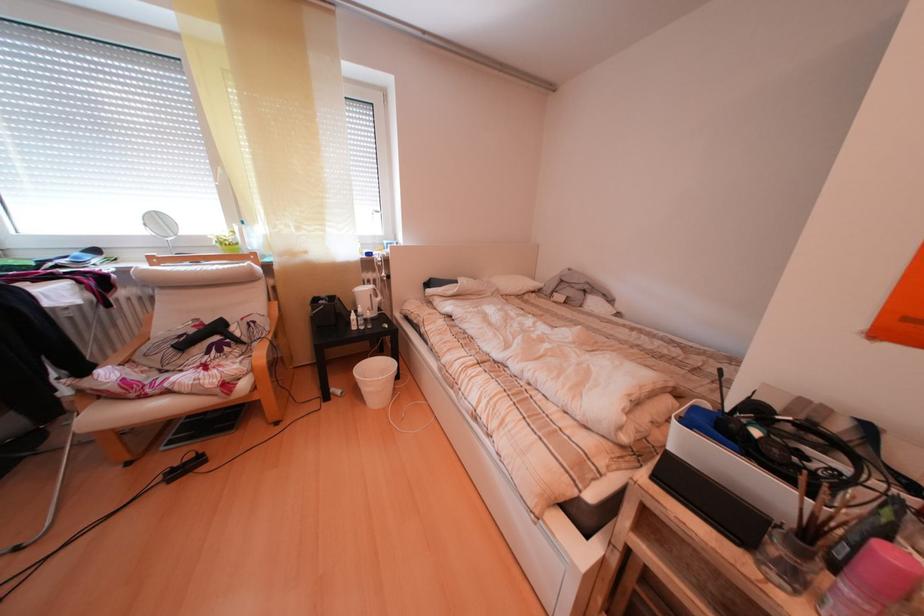
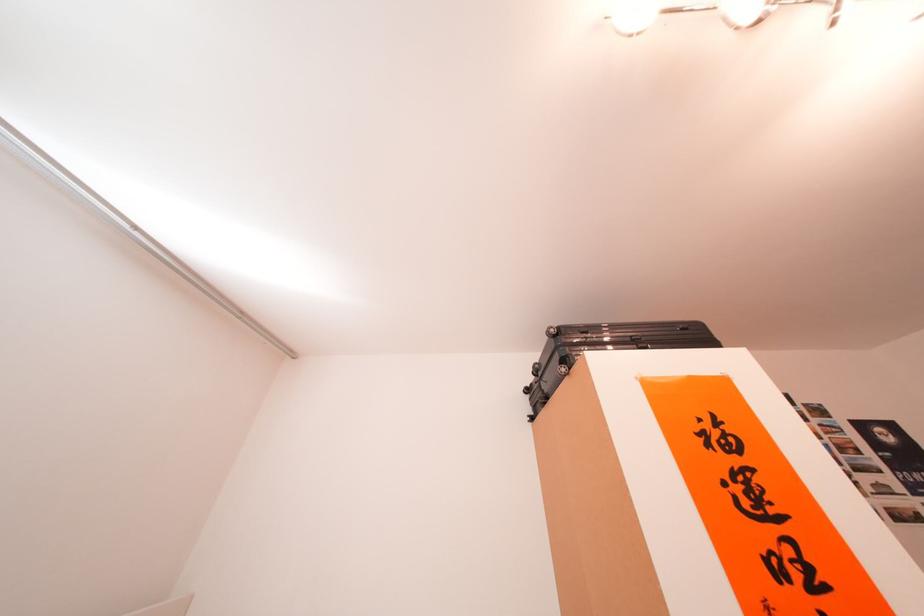
The first image is from the beginning of the video and the second image is from the end. How did the camera likely rotate when shooting the video?

The camera rotated toward right-up.